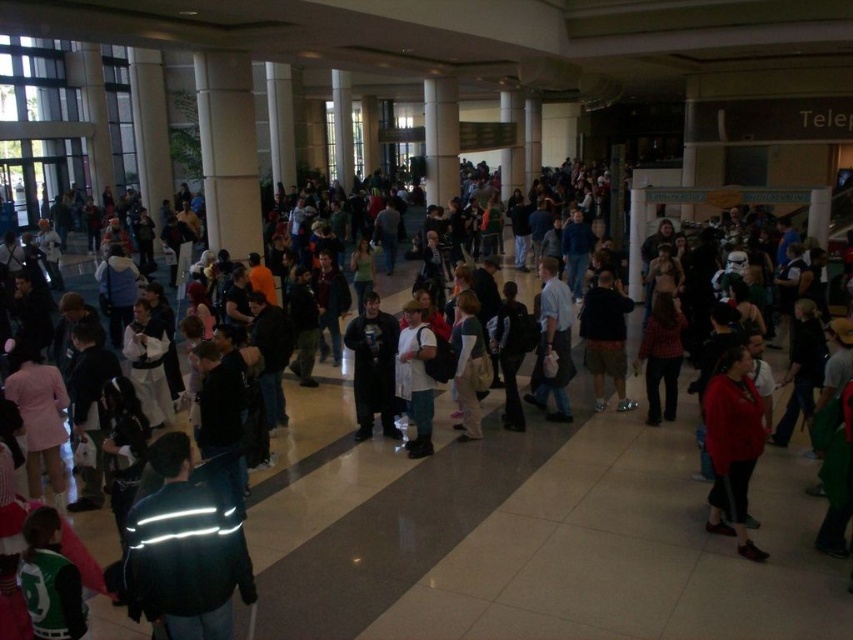
The height and width of the screenshot is (640, 853). Describe the element at coordinates (373, 368) in the screenshot. I see `black matte coat at center` at that location.

Who is higher up, black matte coat at center or light brown leather jacket at center?

black matte coat at center is above.

Which is in front, point (376, 362) or point (471, 416)?

Point (376, 362) is more forward.

Identify the location of black matte coat at center. (373, 368).

Does black matte coat at center appear under light blue shirt at center?

Yes, black matte coat at center is below light blue shirt at center.

Does black matte coat at center appear over light blue shirt at center?

No, black matte coat at center is not above light blue shirt at center.

Is point (395, 432) farther from camera compared to point (564, 296)?

No, it is in front of (564, 296).

Locate an element on the screen. The image size is (853, 640). black matte coat at center is located at coordinates tap(373, 368).

Between point (727, 499) and point (368, 296), which one is positioned in front?

Point (727, 499) is in front.

Does point (712, 440) come closer to viewer compared to point (378, 394)?

Yes, point (712, 440) is in front of point (378, 394).

Where is `matte red sweater at right`? The image size is (853, 640). matte red sweater at right is located at coordinates (732, 445).